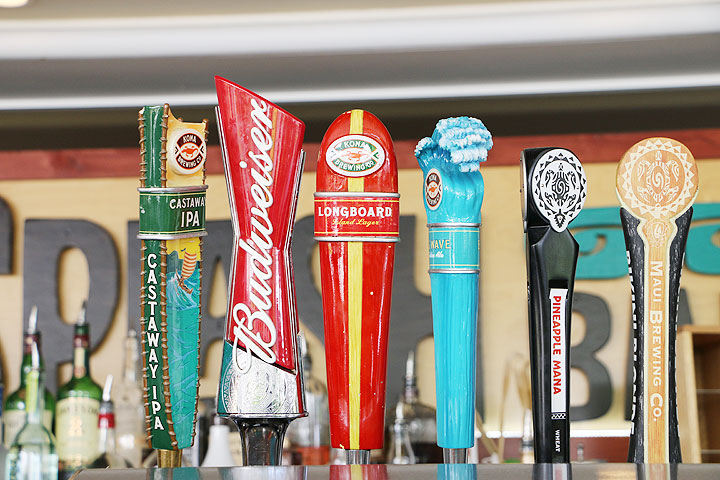
Find the location of a particular element. beer tap handles is located at coordinates (179, 323), (264, 328), (356, 342), (461, 358), (551, 348), (659, 363).